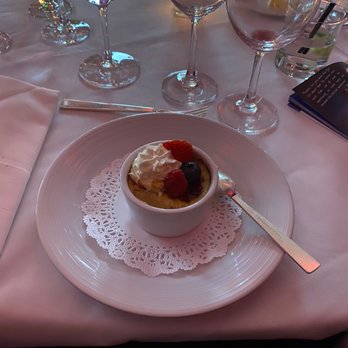
Locate an element on the screen. Image resolution: width=348 pixels, height=348 pixels. silverware is located at coordinates (229, 184), (136, 107).